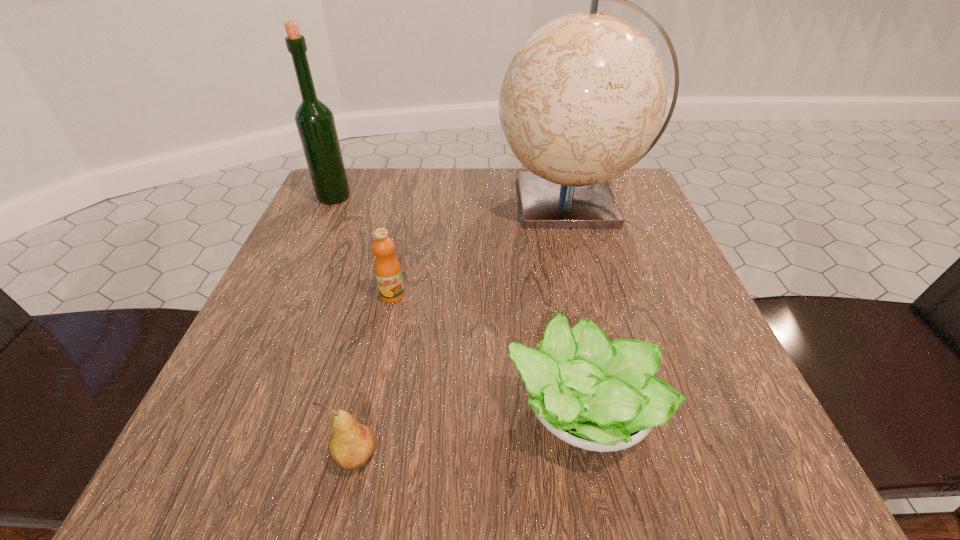
This screenshot has width=960, height=540. What are the coordinates of `vacant region between the lettuce and the globe` in the screenshot? It's located at (576, 306).

At what (x,y) coordinates should I click in order to perform the action: click on free space between the lettuce and the third nearest object. Please return your answer as a coordinate pair (x, y). The height and width of the screenshot is (540, 960). Looking at the image, I should click on [487, 352].

I want to click on unoccupied area between the pear and the liquor, so click(x=345, y=327).

The height and width of the screenshot is (540, 960). What are the coordinates of `free space between the pear and the liquor` in the screenshot? It's located at (345, 327).

I want to click on vacant area that lies between the globe and the pear, so click(464, 329).

Where is `vacant area that lies between the globe and the leftmost object`? Image resolution: width=960 pixels, height=540 pixels. vacant area that lies between the globe and the leftmost object is located at coordinates (453, 199).

At what (x,y) coordinates should I click in order to perform the action: click on vacant region between the liquor and the lettuce. Please return your answer as a coordinate pair (x, y). Looking at the image, I should click on (457, 303).

Identify the location of free space between the pear and the shortest object. The width and height of the screenshot is (960, 540). (468, 433).

Point out which object is positioned as the third nearest to the lettuce. Please provide its 2D coordinates. Your answer should be formatted as a tuple, i.e. [(x, y)], where the tuple contains the x and y coordinates of a point satisfying the conditions above.

[(584, 96)]

You are a GUI agent. You are given a task and a screenshot of the screen. Output one action in this format:
    pyautogui.click(x=<x>, y=<y>)
    Task: Click on the object that stands as the second closest to the pear
    This screenshot has height=540, width=960.
    Given the screenshot: What is the action you would take?
    pyautogui.click(x=387, y=268)